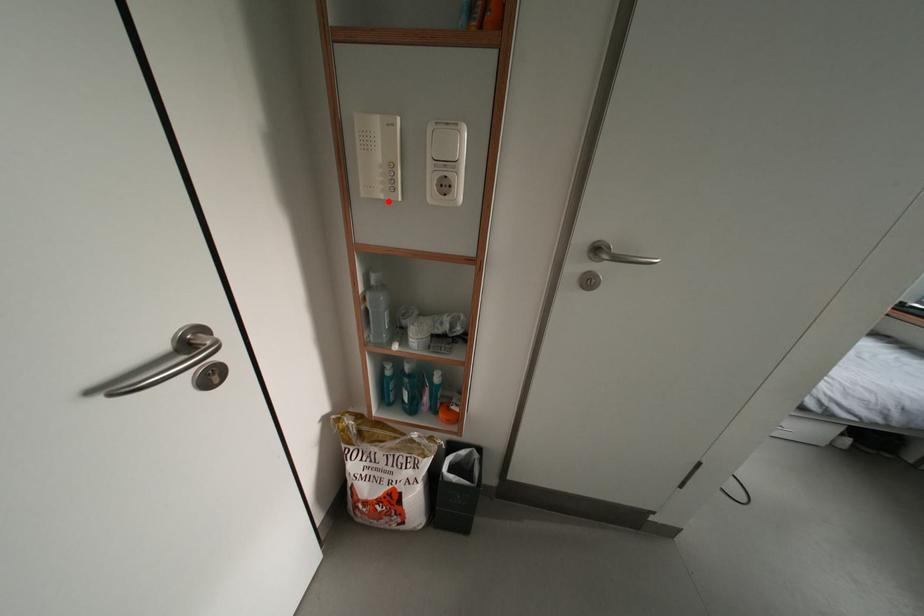
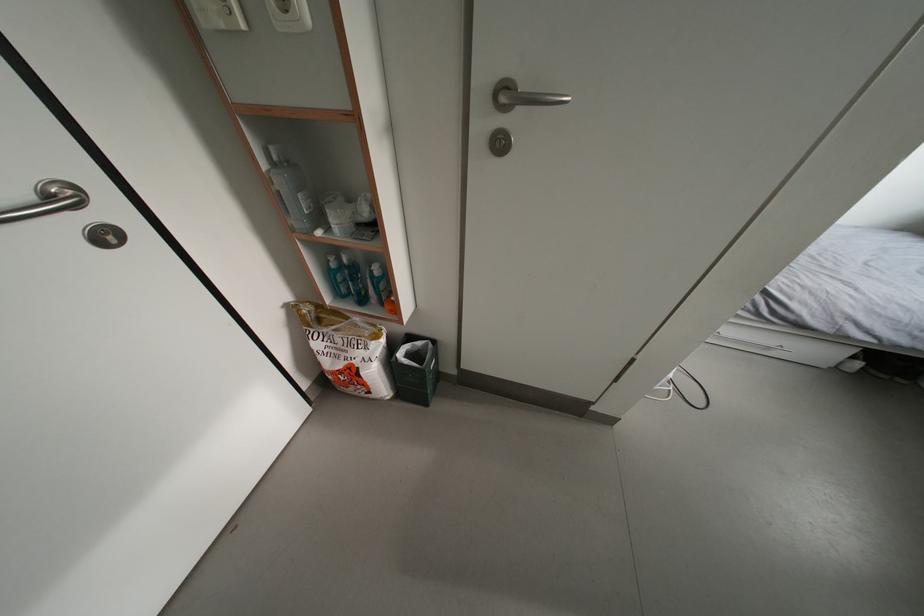
The point at the highlighted location is marked in the first image. Where is the corresponding point in the second image?

(229, 30)